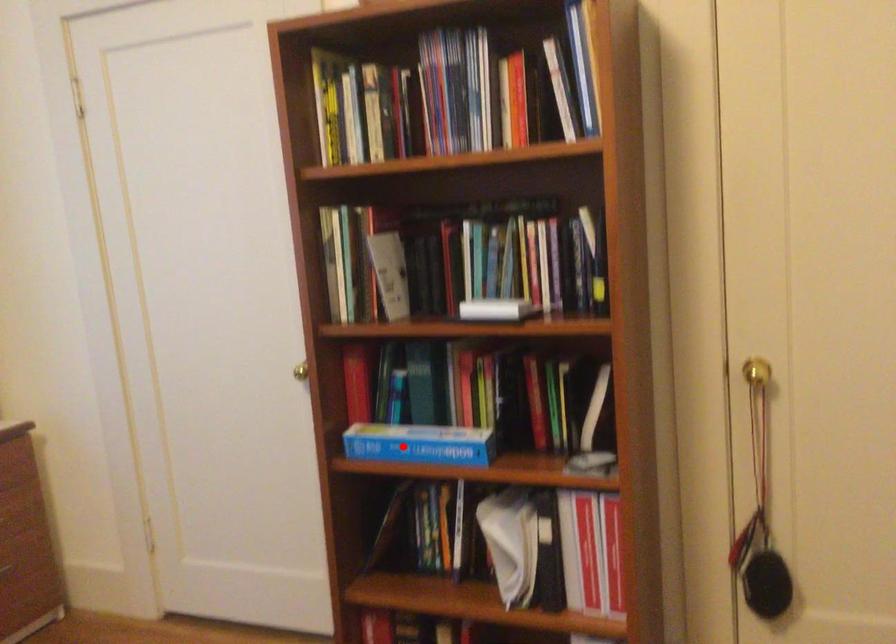
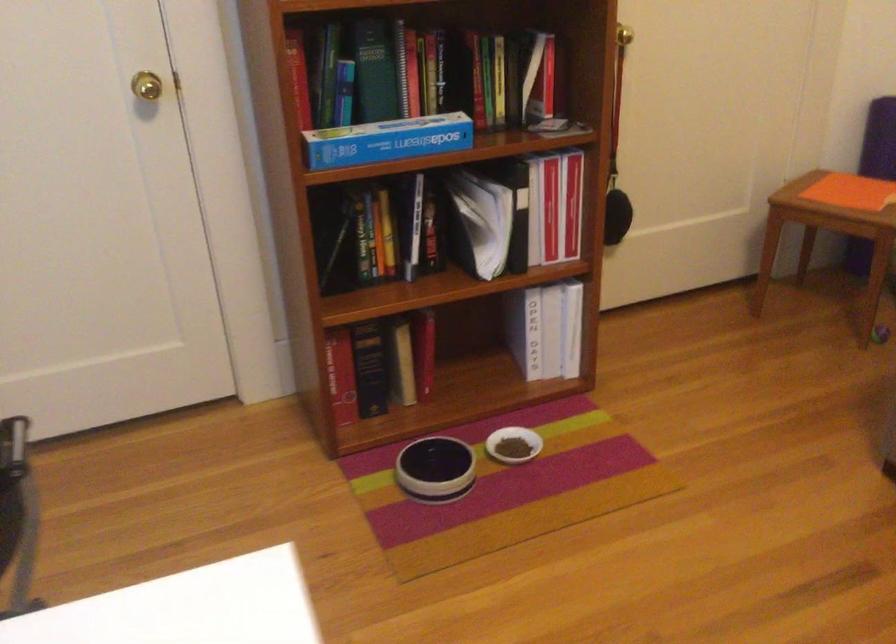
Question: I am providing you with two images of the same scene from different viewpoints. In image1, a red point is highlighted. Considering the same 3D point in image2, which of the following is correct?

Choices:
 (A) It is closer
 (B) It is farther

Answer: (A)